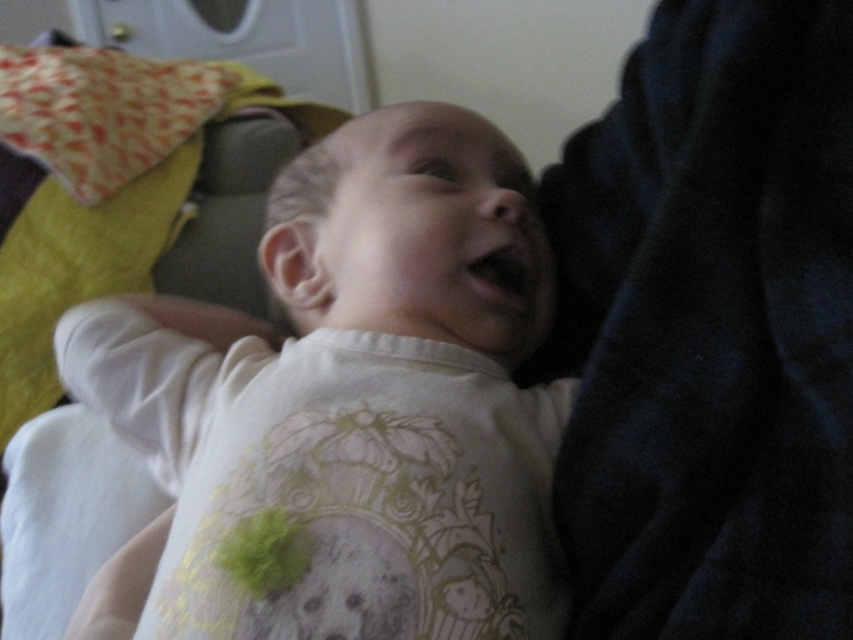
You are a photographer setting up a shoot for a baby product catalog. You need to ensure the white soft baby at center is positioned so it appears larger than the printed fabric pillow at upper left in the final image. Given their current positions, do you think the baby will naturally appear larger in the photo?

The white soft baby at center is much taller than the printed fabric pillow at upper left, so yes, the baby will naturally appear larger in the photo without needing any adjustments.

You are a photographer trying to capture the baby in the image. You notice two points marked in the scene. The first point is at coordinates point [315,593] and the second is at point [218,108]. Which point is closer to the camera lens?

Point [315,593] is in front of point [218,108], so it is closer to the camera lens.

You are a photographer taking a close up photo of a baby. The baby is positioned at the center of the image. You need to place a small prop at point (349, 403). Is the prop placement safe, considering the baby is at center?

The point (349, 403) corresponds to the white soft baby at center, so placing the prop there would be unsafe as it would be directly on the baby.